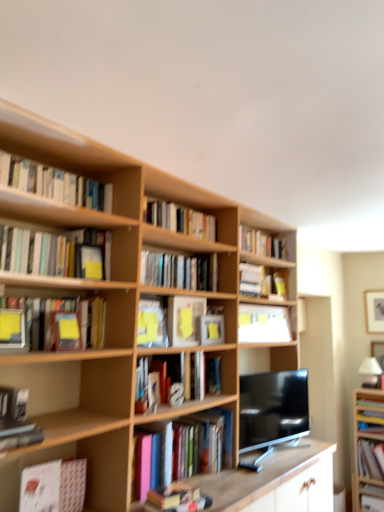
Question: Does hardcover book at center, which ranks as the 6th book in top-to-bottom order, touch matte white book at lower right, the 13th book when ordered from top to bottom?

Choices:
 (A) yes
 (B) no

Answer: (B)

Question: Does hardcover book at center, which ranks as the 6th book in top-to-bottom order, have a lesser width compared to matte white book at lower right, the 13th book when ordered from top to bottom?

Choices:
 (A) yes
 (B) no

Answer: (A)

Question: Is hardcover book at center, which ranks as the 6th book in top-to-bottom order, surrounding matte white book at lower right, the 13th book when ordered from top to bottom?

Choices:
 (A) no
 (B) yes

Answer: (A)

Question: From a real-world perspective, is hardcover book at center, the 8th book in the bottom-to-top sequence, positioned under matte white book at lower right, acting as the 1th book starting from the bottom, based on gravity?

Choices:
 (A) no
 (B) yes

Answer: (A)

Question: Is hardcover book at center, the 8th book in the bottom-to-top sequence, at the left side of matte white book at lower right, the 13th book when ordered from top to bottom?

Choices:
 (A) no
 (B) yes

Answer: (B)

Question: Looking at their shapes, would you say matte white book at lower right, the 13th book when ordered from top to bottom, is wider or thinner than hardcover books at center, which ranks as the fifth book in top-to-bottom order?

Choices:
 (A) wide
 (B) thin

Answer: (A)

Question: Considering the positions of matte white book at lower right, the 13th book when ordered from top to bottom, and hardcover books at center, which appears as the ninth book when ordered from the bottom, in the image, is matte white book at lower right, the 13th book when ordered from top to bottom, taller or shorter than hardcover books at center, which appears as the ninth book when ordered from the bottom,?

Choices:
 (A) tall
 (B) short

Answer: (B)

Question: Is matte white book at lower right, the 13th book when ordered from top to bottom, to the left or to the right of hardcover books at center, which ranks as the fifth book in top-to-bottom order, in the image?

Choices:
 (A) left
 (B) right

Answer: (B)

Question: Considering the positions of point (380, 495) and point (193, 273), is point (380, 495) closer or farther from the camera than point (193, 273)?

Choices:
 (A) farther
 (B) closer

Answer: (A)

Question: From a real-world perspective, is yellow matte paper at center, the 1th paperback book viewed from the back, physically located above or below matte yellow book at upper left, which appears as the 4th book when viewed from the top?

Choices:
 (A) above
 (B) below

Answer: (B)

Question: Relative to matte yellow book at upper left, which appears as the 4th book when viewed from the top, is yellow matte paper at center, the first paperback book positioned from the right, in front or behind?

Choices:
 (A) front
 (B) behind

Answer: (B)

Question: Is yellow matte paper at center, the first paperback book positioned from the right, taller or shorter than matte yellow book at upper left, which appears as the 4th book when viewed from the top?

Choices:
 (A) short
 (B) tall

Answer: (A)

Question: From the image's perspective, is yellow matte paper at center, the 1th paperback book viewed from the back, above or below matte yellow book at upper left, the 10th book when ordered from bottom to top?

Choices:
 (A) above
 (B) below

Answer: (B)

Question: In terms of height, does yellow matte paper at center, marked as the third paperback book in a left-to-right arrangement, look taller or shorter compared to hardcover books at center, which appears as the ninth book when ordered from the bottom?

Choices:
 (A) tall
 (B) short

Answer: (A)

Question: From the image's perspective, is yellow matte paper at center, the second paperback book positioned from the right, above or below hardcover books at center, which appears as the ninth book when ordered from the bottom?

Choices:
 (A) above
 (B) below

Answer: (B)